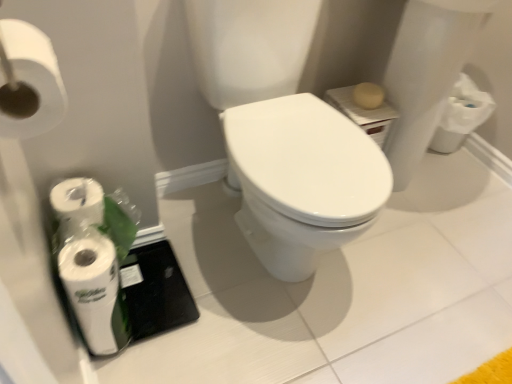
In order to click on white matte toilet paper at upper left, placed as the first toilet paper when sorted from right to left in this screenshot , I will do [x=28, y=81].

Measure the distance between point (42, 131) and camera.

A distance of 54.80 centimeters exists between point (42, 131) and camera.

Describe the element at coordinates (28, 81) in the screenshot. Image resolution: width=512 pixels, height=384 pixels. I see `white matte toilet paper at upper left, which is the first toilet paper from top to bottom` at that location.

What is the approximate height of white matte toilet paper at upper left, which is the 1th toilet paper in front-to-back order?

white matte toilet paper at upper left, which is the 1th toilet paper in front-to-back order, is 4.06 inches tall.

Measure the distance between point (113, 285) and camera.

Point (113, 285) and camera are 33.90 inches apart.

Describe the element at coordinates (94, 291) in the screenshot. The height and width of the screenshot is (384, 512). I see `white matte toilet paper at lower left, the 1th toilet paper from the back` at that location.

Locate an element on the screen. The height and width of the screenshot is (384, 512). white matte toilet paper at lower left, the 1th toilet paper when ordered from left to right is located at coordinates (94, 291).

You are a GUI agent. You are given a task and a screenshot of the screen. Output one action in this format:
    pyautogui.click(x=<x>, y=<y>)
    Task: Click on the white matte toilet paper at upper left, which is the 1th toilet paper in front-to-back order
    This screenshot has width=512, height=384.
    Given the screenshot: What is the action you would take?
    pyautogui.click(x=28, y=81)

Does white matte toilet paper at upper left, placed as the first toilet paper when sorted from right to left, appear on the right side of white matte toilet paper at lower left, the 1th toilet paper when ordered from left to right?

Yes.

Looking at this image, is white matte toilet paper at upper left, placed as the first toilet paper when sorted from right to left, in front of white matte toilet paper at lower left, which is the 2th toilet paper in right-to-left order?

Yes, it is.

Considering the points (55, 62) and (75, 305), which point is behind, point (55, 62) or point (75, 305)?

The point (75, 305) is behind.

From the image's perspective, which is below, white matte toilet paper at upper left, which is the 1th toilet paper in front-to-back order, or white matte toilet paper at lower left, which is the 2th toilet paper in right-to-left order?

white matte toilet paper at lower left, which is the 2th toilet paper in right-to-left order, appears lower in the image.

In the scene shown: From a real-world perspective, who is located higher, white matte toilet paper at upper left, which is counted as the second toilet paper, starting from the left, or white matte toilet paper at lower left, the first toilet paper ordered from the bottom?

white matte toilet paper at upper left, which is counted as the second toilet paper, starting from the left.

Can you confirm if white matte toilet paper at upper left, placed as the first toilet paper when sorted from right to left, is wider than white matte toilet paper at lower left, the 1th toilet paper when ordered from left to right?

Yes.

Considering the relative sizes of white matte toilet paper at upper left, which is counted as the second toilet paper, starting from the left, and white matte toilet paper at lower left, the 1th toilet paper from the back, in the image provided, is white matte toilet paper at upper left, which is counted as the second toilet paper, starting from the left, shorter than white matte toilet paper at lower left, the 1th toilet paper from the back,?

In fact, white matte toilet paper at upper left, which is counted as the second toilet paper, starting from the left, may be taller than white matte toilet paper at lower left, the 1th toilet paper from the back.

Does white matte toilet paper at upper left, which is counted as the second toilet paper, starting from the left, have a smaller size compared to white matte toilet paper at lower left, placed as the second toilet paper when sorted from top to bottom?

No.

Would you say white matte toilet paper at upper left, which is counted as the second toilet paper, starting from the left, contains white matte toilet paper at lower left, which is the 2th toilet paper in right-to-left order?

No, white matte toilet paper at lower left, which is the 2th toilet paper in right-to-left order, is not surrounded by white matte toilet paper at upper left, which is counted as the second toilet paper, starting from the left.

Is white matte toilet paper at upper left, which is the 1th toilet paper in front-to-back order, not near white matte toilet paper at lower left, which is the 2th toilet paper in right-to-left order?

white matte toilet paper at upper left, which is the 1th toilet paper in front-to-back order, is actually quite close to white matte toilet paper at lower left, which is the 2th toilet paper in right-to-left order.

Is white matte toilet paper at upper left, which is counted as the second toilet paper, starting from the left, oriented towards white matte toilet paper at lower left, the second toilet paper viewed from the front?

No, white matte toilet paper at upper left, which is counted as the second toilet paper, starting from the left, does not turn towards white matte toilet paper at lower left, the second toilet paper viewed from the front.

How many degrees apart are the facing directions of white matte toilet paper at upper left, placed as the first toilet paper when sorted from right to left, and white matte toilet paper at lower left, placed as the second toilet paper when sorted from top to bottom?

2.25 degrees.

How far apart are white matte toilet paper at upper left, which is counted as the second toilet paper, starting from the left, and white matte toilet paper at lower left, the second toilet paper viewed from the front?

white matte toilet paper at upper left, which is counted as the second toilet paper, starting from the left, and white matte toilet paper at lower left, the second toilet paper viewed from the front, are 16.44 inches apart from each other.

Identify the location of toilet paper located below the white matte toilet paper at upper left, which is the first toilet paper from top to bottom (from the image's perspective). The height and width of the screenshot is (384, 512). 94,291.

From the picture: Which object is positioned more to the right, white matte toilet paper at lower left, the second toilet paper viewed from the front, or white matte toilet paper at upper left, which is counted as the second toilet paper, starting from the left?

From the viewer's perspective, white matte toilet paper at upper left, which is counted as the second toilet paper, starting from the left, appears more on the right side.

Is white matte toilet paper at lower left, which is the 2th toilet paper in right-to-left order, closer to the viewer compared to white matte toilet paper at upper left, which is the 1th toilet paper in front-to-back order?

No, the depth of white matte toilet paper at lower left, which is the 2th toilet paper in right-to-left order, is greater than that of white matte toilet paper at upper left, which is the 1th toilet paper in front-to-back order.

Is point (91, 348) closer or farther from the camera than point (21, 112)?

Point (91, 348) appears to be farther away from the viewer than point (21, 112).

From the image's perspective, would you say white matte toilet paper at lower left, the 1th toilet paper from the back, is shown under white matte toilet paper at upper left, which appears as the 2th toilet paper when viewed from the back?

Yes.

From a real-world perspective, is white matte toilet paper at lower left, the 1th toilet paper when ordered from left to right, above or below white matte toilet paper at upper left, which is the first toilet paper from top to bottom?

white matte toilet paper at lower left, the 1th toilet paper when ordered from left to right, is below white matte toilet paper at upper left, which is the first toilet paper from top to bottom.

Does white matte toilet paper at lower left, placed as the second toilet paper when sorted from top to bottom, have a greater width compared to white matte toilet paper at upper left, which appears as the 2th toilet paper when viewed from the back?

Incorrect, the width of white matte toilet paper at lower left, placed as the second toilet paper when sorted from top to bottom, does not surpass that of white matte toilet paper at upper left, which appears as the 2th toilet paper when viewed from the back.

Between white matte toilet paper at lower left, placed as the second toilet paper when sorted from top to bottom, and white matte toilet paper at upper left, placed as the first toilet paper when sorted from right to left, which one has more height?

white matte toilet paper at upper left, placed as the first toilet paper when sorted from right to left.

Is white matte toilet paper at lower left, the second toilet paper viewed from the front, bigger or smaller than white matte toilet paper at upper left, placed as the first toilet paper when sorted from right to left?

Considering their sizes, white matte toilet paper at lower left, the second toilet paper viewed from the front, takes up less space than white matte toilet paper at upper left, placed as the first toilet paper when sorted from right to left.

Choose the correct answer: Is white matte toilet paper at lower left, the first toilet paper ordered from the bottom, inside white matte toilet paper at upper left, which is the 1th toilet paper in front-to-back order, or outside it?

white matte toilet paper at lower left, the first toilet paper ordered from the bottom, is outside white matte toilet paper at upper left, which is the 1th toilet paper in front-to-back order.

Is white matte toilet paper at lower left, the 1th toilet paper from the back, positioned far away from white matte toilet paper at upper left, which appears as the 2th toilet paper when viewed from the back?

They are positioned close to each other.

Is white matte toilet paper at lower left, the 1th toilet paper when ordered from left to right, facing towards white matte toilet paper at upper left, which appears as the 2th toilet paper when viewed from the back?

No.

Find the location of a particular element. Image resolution: width=512 pixels, height=384 pixels. toilet paper on the right of white matte toilet paper at lower left, the first toilet paper ordered from the bottom is located at coordinates (28, 81).

What are the coordinates of `toilet paper lying in front of the white matte toilet paper at lower left, the first toilet paper ordered from the bottom` in the screenshot? It's located at (28, 81).

Image resolution: width=512 pixels, height=384 pixels. In the image, there is a white matte toilet paper at lower left, the 1th toilet paper from the back. Find the location of `toilet paper above it (from the image's perspective)`. toilet paper above it (from the image's perspective) is located at coordinates (28, 81).